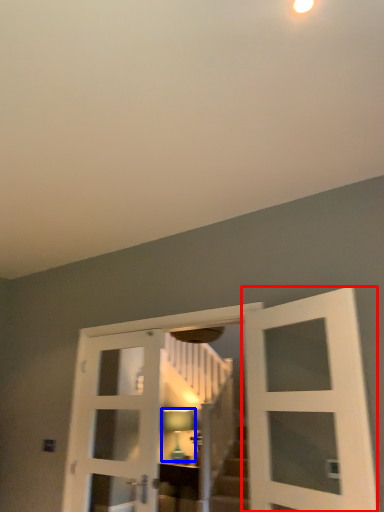
Question: Which object is further to the camera taking this photo, door (highlighted by a red box) or light fixture (highlighted by a blue box)?

Choices:
 (A) door
 (B) light fixture

Answer: (B)